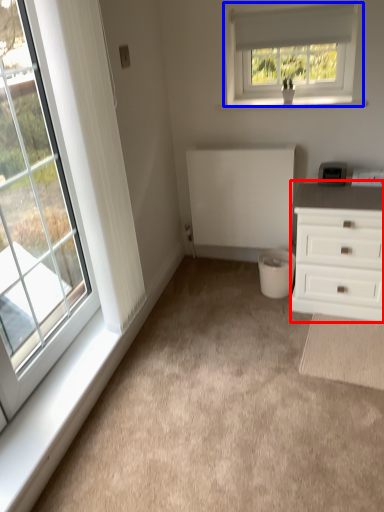
Question: Which object appears farthest to the camera in this image, chest of drawers (highlighted by a red box) or window (highlighted by a blue box)?

Choices:
 (A) chest of drawers
 (B) window

Answer: (B)